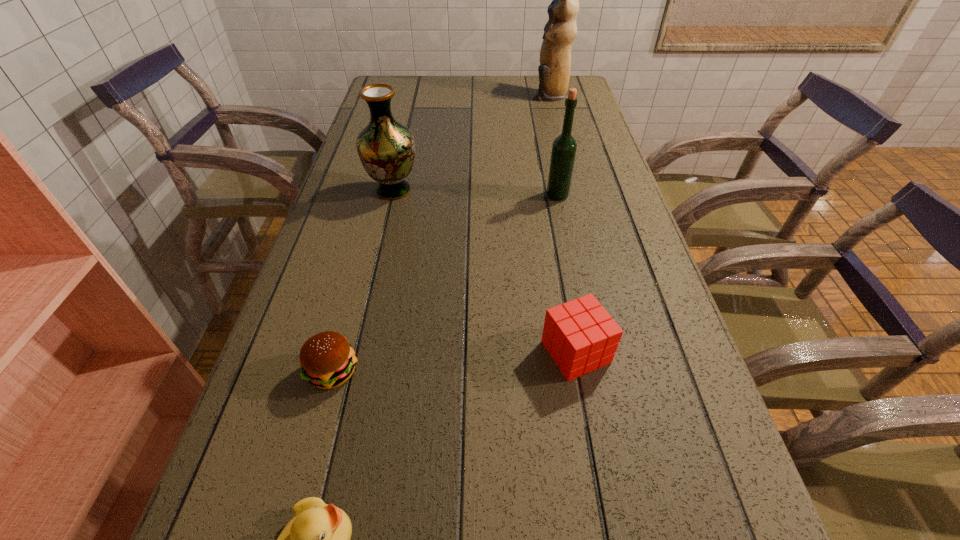
You are a GUI agent. You are given a task and a screenshot of the screen. Output one action in this format:
    pyautogui.click(x=<x>, y=<y>)
    Task: Click on the farthest object
    This screenshot has height=540, width=960.
    Given the screenshot: What is the action you would take?
    pyautogui.click(x=560, y=31)

The width and height of the screenshot is (960, 540). I want to click on the tallest object, so click(560, 31).

Identify the location of liquor. (564, 147).

In order to click on vase in this screenshot , I will do `click(386, 148)`.

I want to click on cube, so click(580, 335).

You are a GUI agent. You are given a task and a screenshot of the screen. Output one action in this format:
    pyautogui.click(x=<x>, y=<y>)
    Task: Click on the hamburger
    This screenshot has height=540, width=960.
    Given the screenshot: What is the action you would take?
    pyautogui.click(x=327, y=360)

You are a GUI agent. You are given a task and a screenshot of the screen. Output one action in this format:
    pyautogui.click(x=<x>, y=<y>)
    Task: Click on the vacant position located 0.150m on the face of the cat
    
    Given the screenshot: What is the action you would take?
    pyautogui.click(x=491, y=95)

Where is `vacant space located on the face of the cat`? Image resolution: width=960 pixels, height=540 pixels. vacant space located on the face of the cat is located at coordinates (432, 95).

Locate an element on the screen. This screenshot has width=960, height=540. vacant area situated 0.180m on the face of the cat is located at coordinates (482, 95).

The height and width of the screenshot is (540, 960). In order to click on vacant region located on the left of the liquor in this screenshot , I will do `click(405, 195)`.